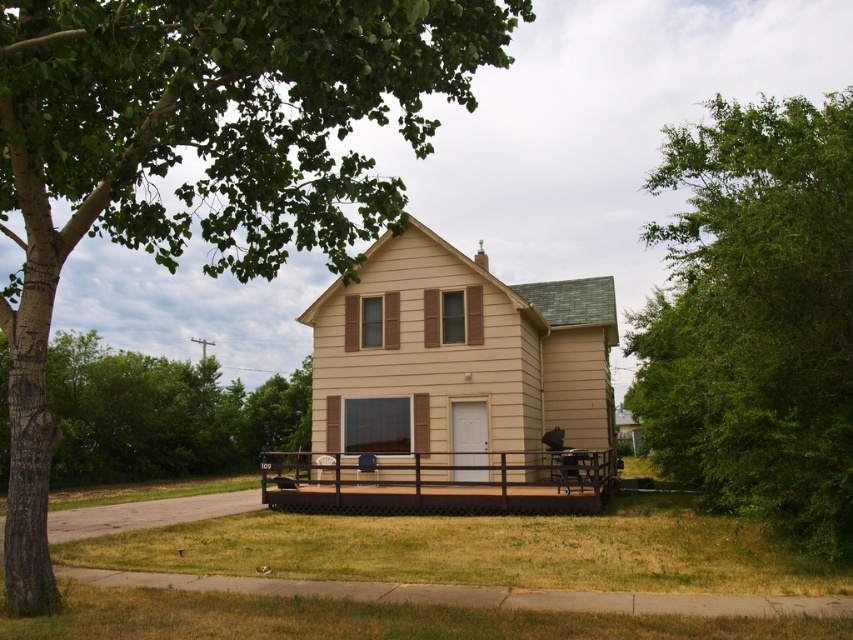
Question: Which object is closer to the camera taking this photo?

Choices:
 (A) green leafy tree at upper left
 (B) green leafy tree at right

Answer: (A)

Question: Which point appears farthest from the camera in this image?

Choices:
 (A) (126, 406)
 (B) (28, 202)
 (C) (296, 481)

Answer: (A)

Question: Is green leafy tree at right smaller than brown wood deck at lower center?

Choices:
 (A) no
 (B) yes

Answer: (A)

Question: Among these objects, which one is nearest to the camera?

Choices:
 (A) brown wood deck at lower center
 (B) green leafy tree at right
 (C) green leafy tree at upper left
 (D) matte black chair at center

Answer: (C)

Question: In this image, where is green leafy tree at lower left located relative to brown wooden picnic table at lower right?

Choices:
 (A) above
 (B) below

Answer: (A)

Question: Does brown wood deck at lower center appear under brown wooden picnic table at lower right?

Choices:
 (A) no
 (B) yes

Answer: (B)